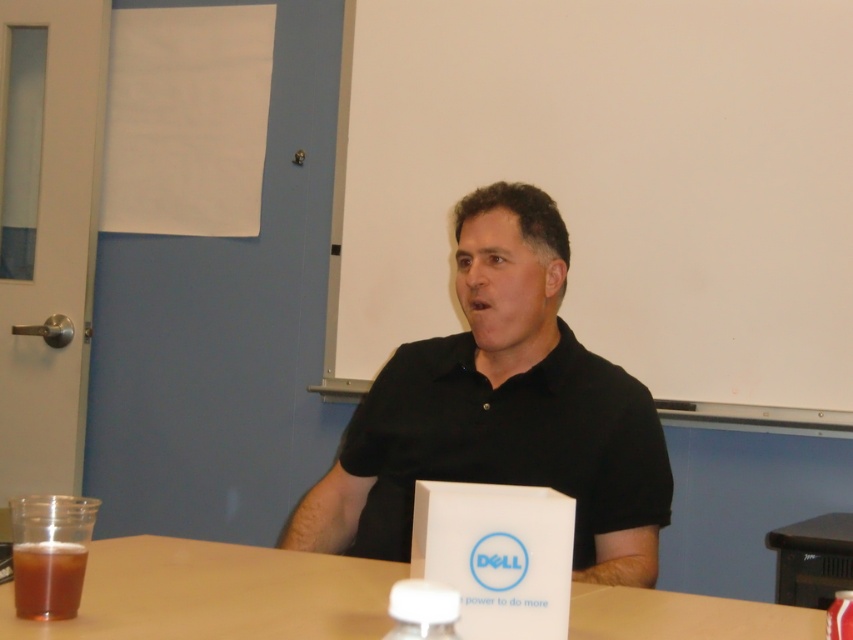
Is black matte shirt at center thinner than white plastic bottle at lower center?

Incorrect, black matte shirt at center's width is not less than white plastic bottle at lower center's.

Which of these two, black matte shirt at center or white plastic bottle at lower center, stands shorter?

white plastic bottle at lower center

Is point (529, 433) positioned before point (401, 637)?

No.

The width and height of the screenshot is (853, 640). I want to click on black matte shirt at center, so click(x=502, y=410).

The width and height of the screenshot is (853, 640). Describe the element at coordinates (612, 186) in the screenshot. I see `white matte board at upper center` at that location.

Is white matte board at upper center bigger than black matte shirt at center?

Indeed, white matte board at upper center has a larger size compared to black matte shirt at center.

Is point (813, 269) more distant than point (630, 392)?

Yes, point (813, 269) is behind point (630, 392).

Where is `white matte board at upper center`? white matte board at upper center is located at coordinates (612, 186).

Is white matte board at upper center thinner than white plastic bottle at lower center?

In fact, white matte board at upper center might be wider than white plastic bottle at lower center.

Is point (511, 77) positioned in front of point (403, 596)?

That is False.

At what (x,y) coordinates should I click in order to perform the action: click on white matte board at upper center. Please return your answer as a coordinate pair (x, y). Looking at the image, I should click on (612, 186).